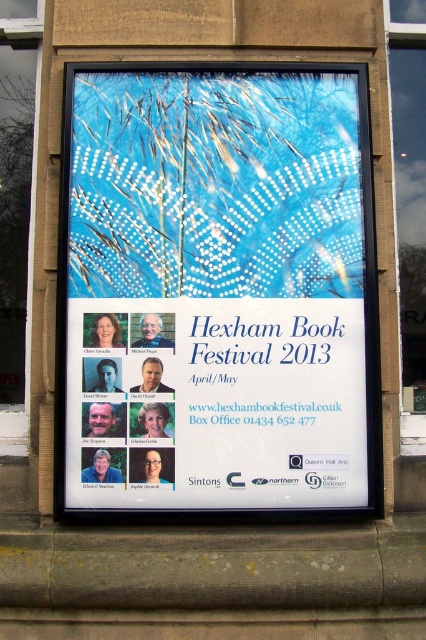
You are standing in front of the Hexham Book Festival poster and notice two transparent glass windows. The first is the transparent glass window at left, and the second is the transparent glass window at center. Which window is nearer to you?

The transparent glass window at left is closer to the viewer than the transparent glass window at center.

You are an event organizer checking the display area. You see the blue paper poster at center and the transparent glass window at center. Which object is shorter in height?

The blue paper poster at center has a lesser height compared to the transparent glass window at center, so the blue paper poster at center is shorter in height.

You are standing in front of the Hexham Book Festival poster. There are two points on the poster, one at point coordinates point (17, 93) and another at point coordinates point (420, 35). Which point is closer to you?

Point (420, 35) is closer to you because it is in front of point (17, 93).